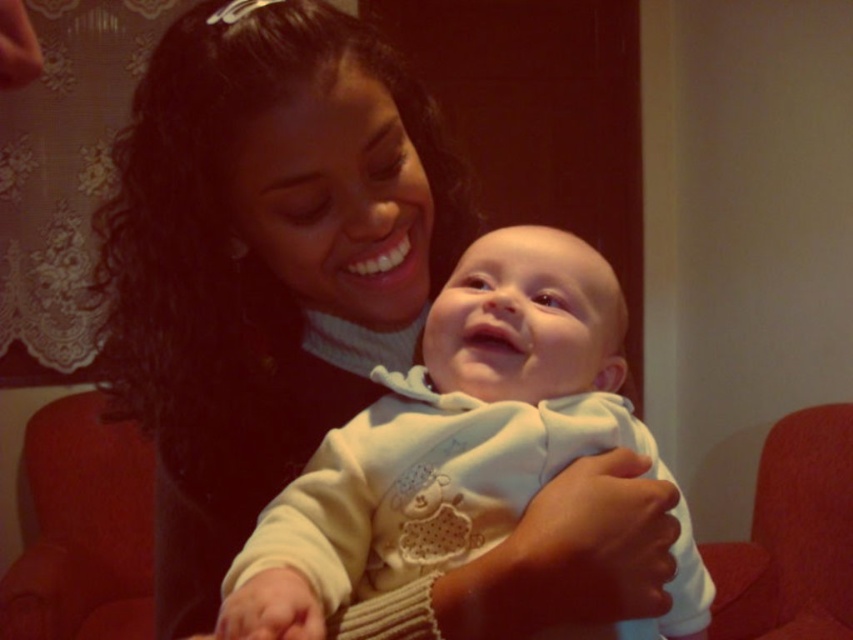
Question: Does white soft fabric baby at center appear over red fabric armchair at lower right?

Choices:
 (A) no
 (B) yes

Answer: (B)

Question: Is white soft fabric baby at center in front of red fabric armchair at lower right?

Choices:
 (A) no
 (B) yes

Answer: (B)

Question: Is white soft fabric baby at center bigger than red fabric armchair at lower right?

Choices:
 (A) no
 (B) yes

Answer: (A)

Question: Which point is farther to the camera?

Choices:
 (A) (611, 422)
 (B) (814, 611)

Answer: (B)

Question: Which point is farther from the camera taking this photo?

Choices:
 (A) (830, 490)
 (B) (518, 429)

Answer: (A)